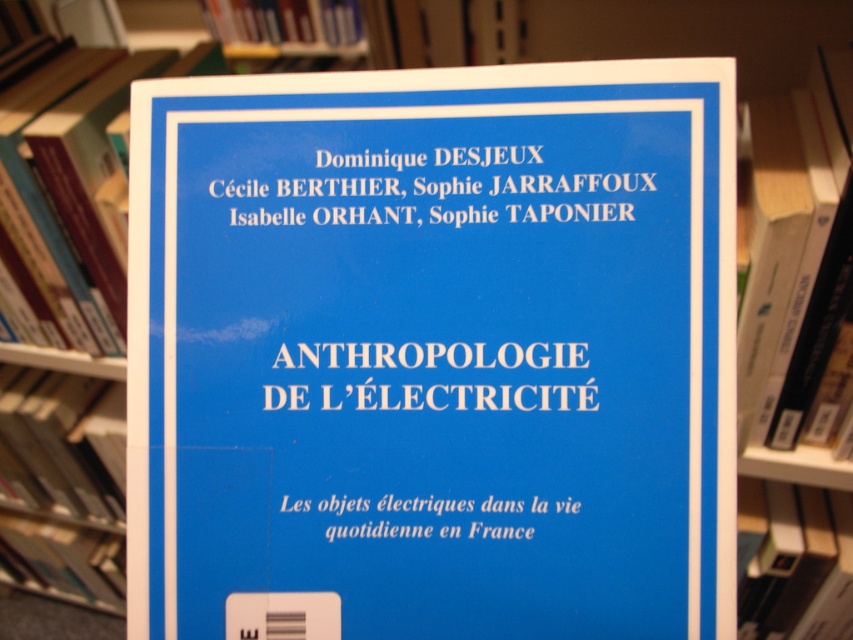
You are designing a promotional poster for the book and need to ensure that the white text at upper center and the blue matte book at left are both visible. Based on their sizes, which one should you prioritize placing first to ensure it stands out more?

The blue matte book at left should be prioritized because it occupies more space than the white text at upper center, making it naturally more prominent.

You are a librarian who needs to place a new book on a shelf. The shelf has a maximum length of 30 inches. You have two items to place here, the blue paper at center and the blue hardcover book at center. Can both items fit on the shelf together?

The blue paper at center and blue hardcover book at center are 31.75 inches apart, so they cannot both fit on the shelf since the total length required exceeds the shelf maximum of 30 inches.